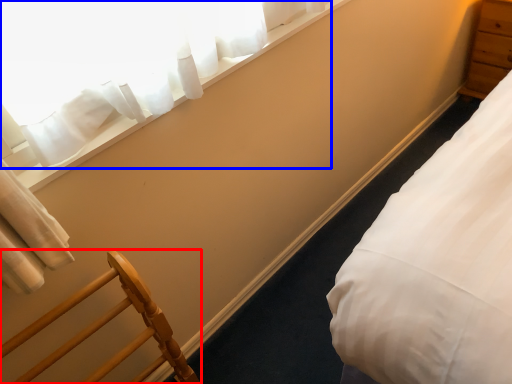
Question: Which object appears farthest to the camera in this image, furniture (highlighted by a red box) or curtain (highlighted by a blue box)?

Choices:
 (A) furniture
 (B) curtain

Answer: (B)